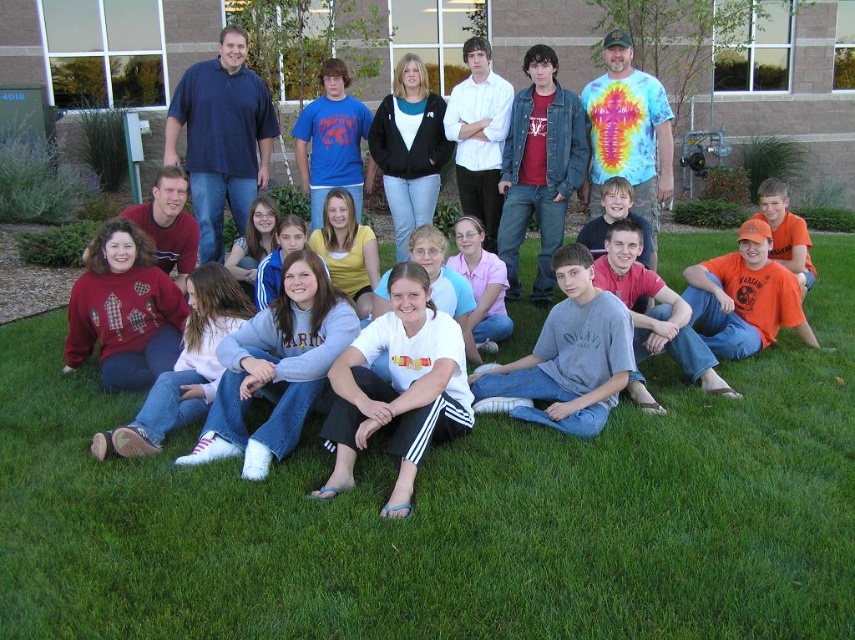
You are a photographer trying to capture the entire group in a single shot. Given the scene described, can the white cotton shirt at center be fully visible without being cut off by the edge of the frame if you focus on the green grass at lower center?

The green grass at lower center has a larger width than the white cotton shirt at center. Since focusing on the grass area would require framing that accommodates its wider span, the white cotton shirt at center should remain fully visible within the frame.

You are standing at the edge of the grassy area and want to place a 10 feet long banner between the green grass at lower center and the building in the background. Will the banner fit?

The distance between the green grass at lower center and the building is 11.23 feet, so the 10 feet long banner will fit comfortably between them.

You are a photographer standing at the camera position. You want to ensure that the green grass at lower center is in focus while capturing the group. What should you adjust to achieve this?

To ensure the green grass at lower center is in focus, adjust the focus point to the green grass at lower center, which is 3.42 meters away from the camera.